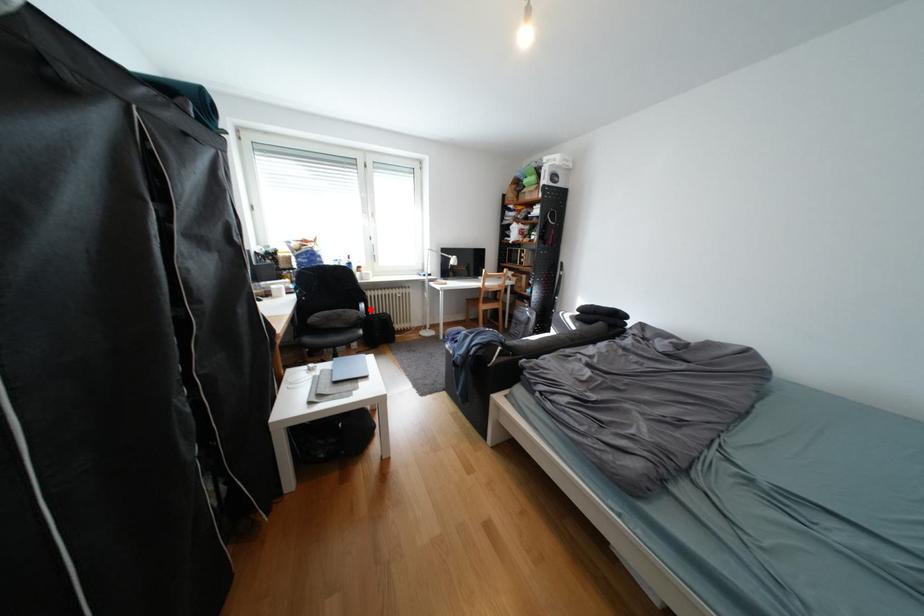
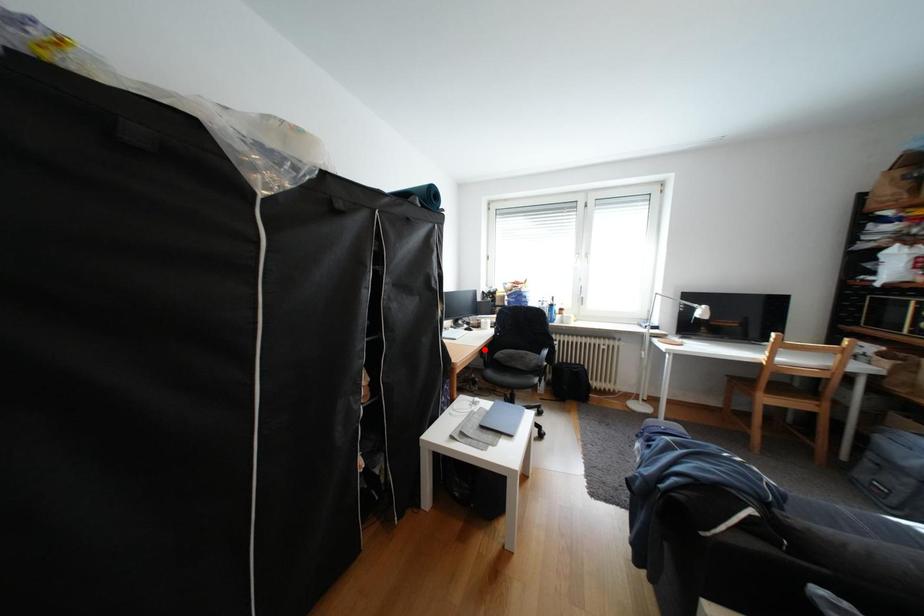
I am providing you with two images of the same scene from different viewpoints. A red point is marked on the first image and another point is marked on the second image. Is the marked point in image1 the same physical position as the marked point in image2?

No